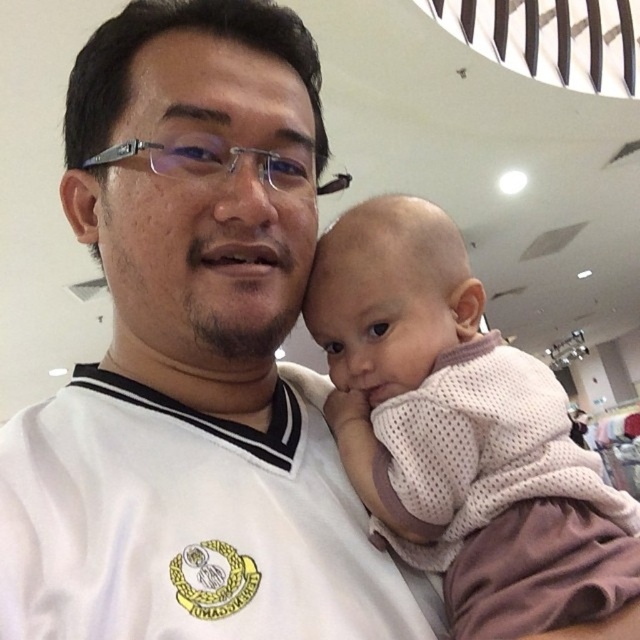
Consider the image. Is white mesh shirt at center to the right of pink mesh shirt at center from the viewer's perspective?

In fact, white mesh shirt at center is to the left of pink mesh shirt at center.

Is white mesh shirt at center below pink mesh shirt at center?

No, white mesh shirt at center is not below pink mesh shirt at center.

Between point (88, 508) and point (522, 433), which one is positioned behind?

The point (522, 433) is more distant.

Where is `white mesh shirt at center`? white mesh shirt at center is located at coordinates (193, 364).